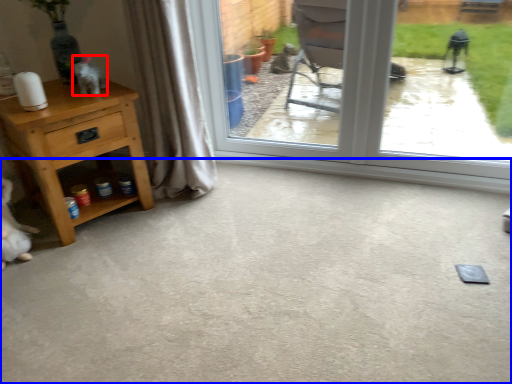
Question: Among these objects, which one is farthest to the camera, animal (highlighted by a red box) or concrete (highlighted by a blue box)?

Choices:
 (A) animal
 (B) concrete

Answer: (A)